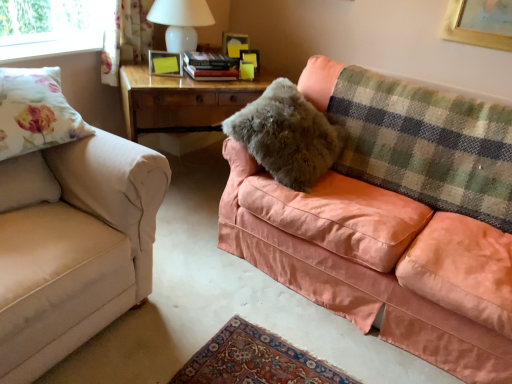
Locate an element on the screen. Image resolution: width=512 pixels, height=384 pixels. unoccupied region to the right of beige fabric couch at left, marked as the 2th studio couch in a right-to-left arrangement is located at coordinates (210, 310).